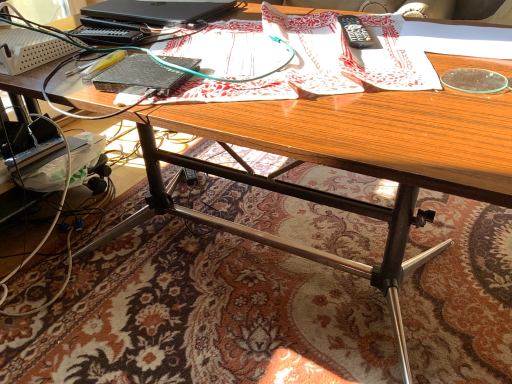
The height and width of the screenshot is (384, 512). I want to click on free spot behind black plastic remote control at upper right, so click(x=330, y=21).